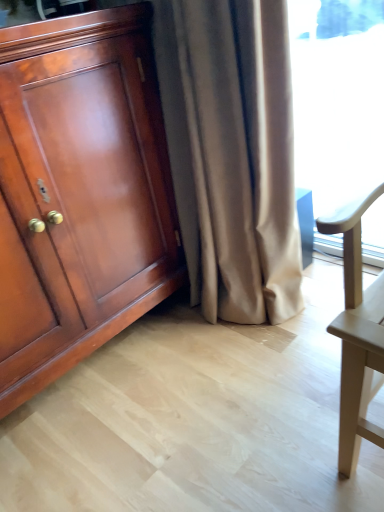
Question: Does shiny wood cabinet at left come behind satin beige curtain at center?

Choices:
 (A) no
 (B) yes

Answer: (A)

Question: Does shiny wood cabinet at left have a greater width compared to satin beige curtain at center?

Choices:
 (A) no
 (B) yes

Answer: (B)

Question: Is shiny wood cabinet at left next to satin beige curtain at center?

Choices:
 (A) no
 (B) yes

Answer: (A)

Question: Is shiny wood cabinet at left at the left side of satin beige curtain at center?

Choices:
 (A) yes
 (B) no

Answer: (A)

Question: Could satin beige curtain at center be considered to be inside shiny wood cabinet at left?

Choices:
 (A) no
 (B) yes

Answer: (A)

Question: Is shiny wood cabinet at left smaller than satin beige curtain at center?

Choices:
 (A) no
 (B) yes

Answer: (A)

Question: Is satin beige curtain at center facing towards shiny wood cabinet at left?

Choices:
 (A) no
 (B) yes

Answer: (A)

Question: Is the depth of satin beige curtain at center less than that of shiny wood cabinet at left?

Choices:
 (A) no
 (B) yes

Answer: (A)

Question: Does satin beige curtain at center have a lesser height compared to shiny wood cabinet at left?

Choices:
 (A) yes
 (B) no

Answer: (B)

Question: From a real-world perspective, does satin beige curtain at center stand above shiny wood cabinet at left?

Choices:
 (A) no
 (B) yes

Answer: (A)

Question: From the image's perspective, is satin beige curtain at center located beneath shiny wood cabinet at left?

Choices:
 (A) yes
 (B) no

Answer: (B)

Question: Does satin beige curtain at center have a lesser width compared to shiny wood cabinet at left?

Choices:
 (A) yes
 (B) no

Answer: (A)

Question: Is point (289, 103) closer or farther from the camera than point (49, 182)?

Choices:
 (A) farther
 (B) closer

Answer: (A)